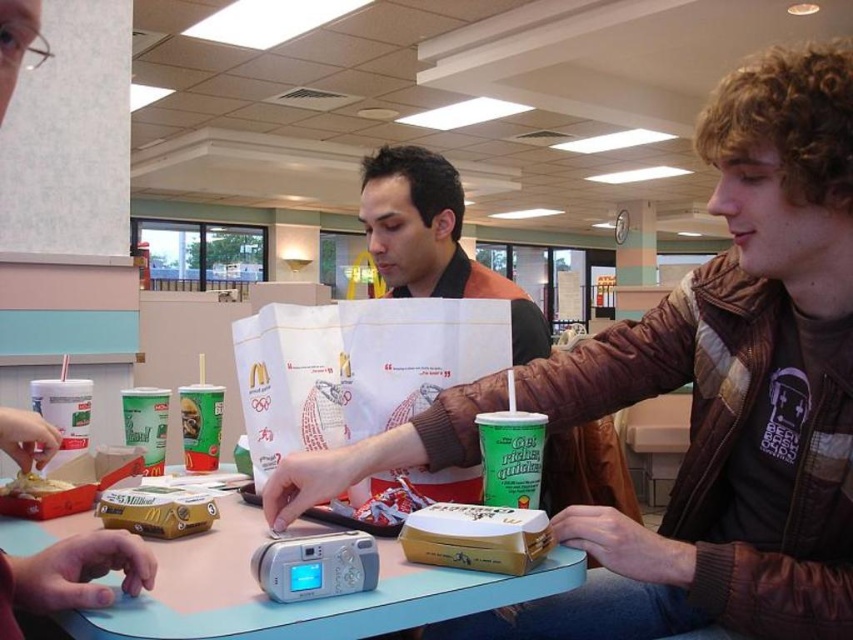
You are a photographer trying to capture a closeup shot of the golden crispy chicken at center. The matte black camera at center is currently in your way. Can you move the camera to the side to get a better angle? Explain why or why not based on their sizes.

The matte black camera at center is larger than the golden crispy chicken at center, so moving it might be necessary to avoid blocking the shot. Since the camera is bigger, you can move it aside to create space for the chicken to be the focus.

You are a photographer trying to capture a clear shot of the McDonalds items on the table. You have two cameras available, the metallic silver camera at center and the matte black camera at center. Which camera should you use to ensure it doesn not block the view of the McDonalds items?

The matte black camera at center is behind the metallic silver camera at center, so using the metallic silver camera at center would be better to avoid blocking the view of the McDonalds items.

Looking at this image, you are a photographer who wants to take a photo of the matte black camera at center. However, there is a brown leather jacket at center blocking the view. Can you move the jacket to the left to get a clear shot?

The brown leather jacket at center is positioned on the right side of the matte black camera at center, so moving it to the left would allow you to see the matte black camera at center without obstruction.